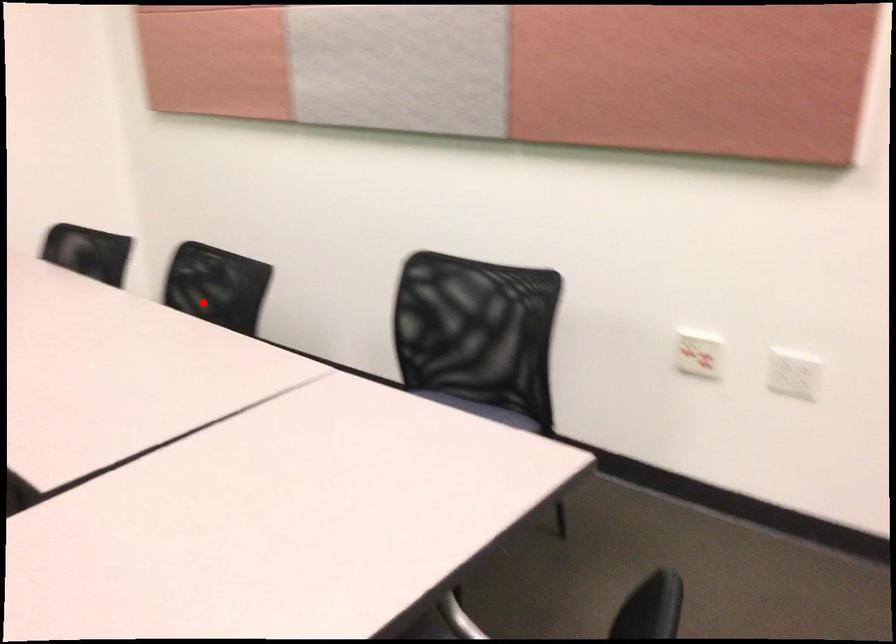
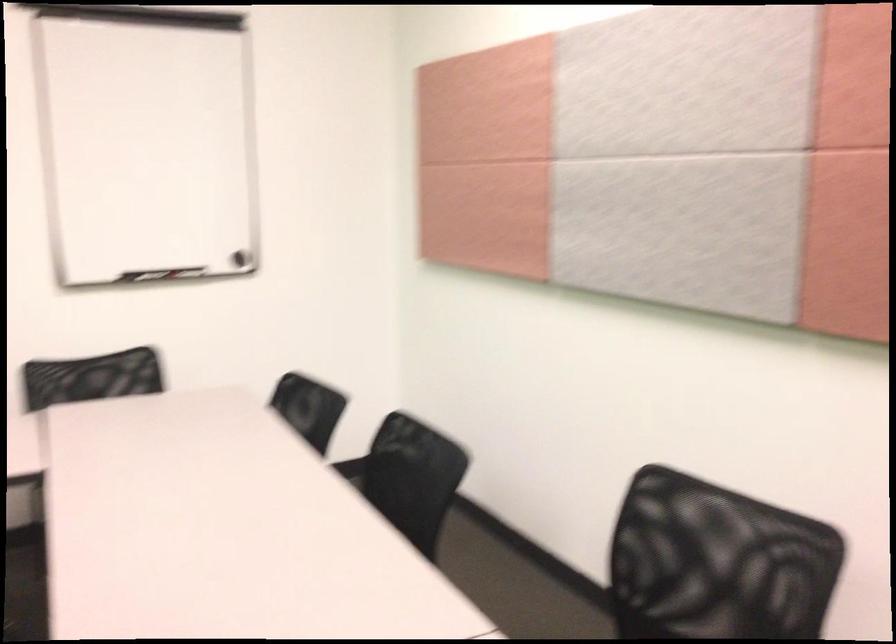
The point at the highlighted location is marked in the first image. Where is the corresponding point in the second image?

(412, 478)